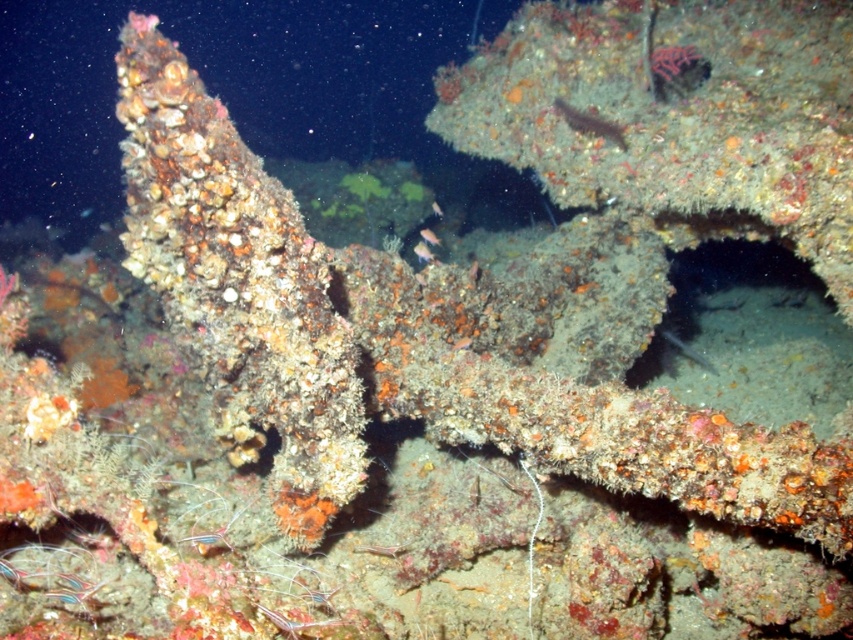
You are a marine biologist studying underwater life. You observe the silvery metallic fish at center in the image. What are the coordinates of this fish?

The silvery metallic fish at center is located at coordinates point (686,349).

You are a marine biologist studying underwater structures. You notice a point marked at coordinates (422, 252) in the image. Based on the scene described, what object is this point located on?

The point at coordinates (422, 252) is located on the shiny silver fish at center.